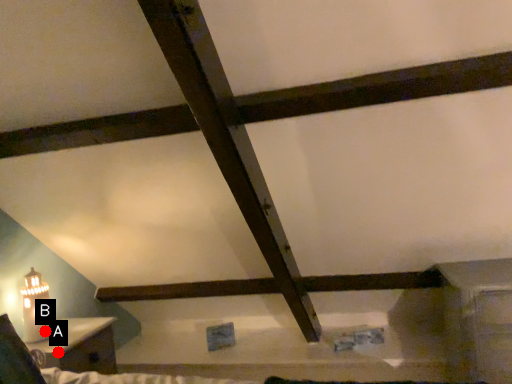
Question: Two points are circled on the image, labeled by A and B beside each circle. Among these points, which one is nearest to the camera?

Choices:
 (A) A is closer
 (B) B is closer

Answer: (A)